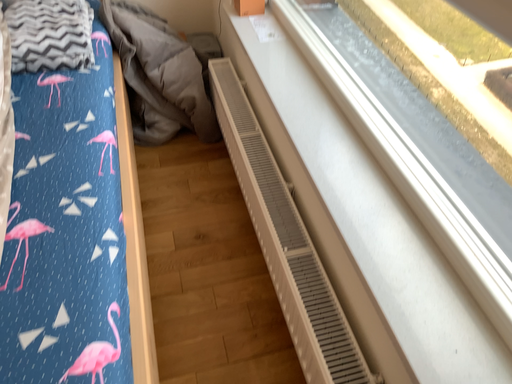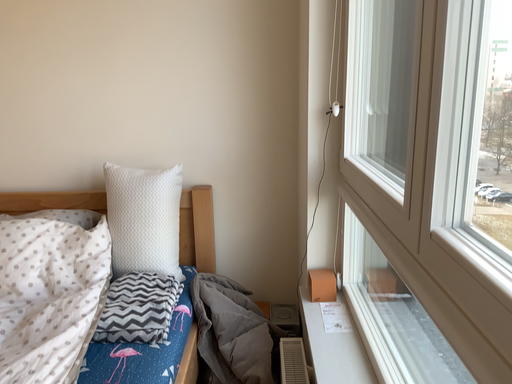
Question: How did the camera likely rotate when shooting the video?

Choices:
 (A) rotated right
 (B) rotated left

Answer: (B)